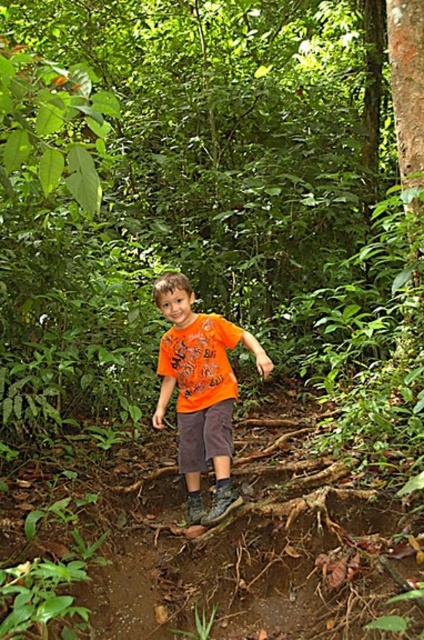
Question: Can you confirm if orange cotton shirt at center is positioned above orange cotton shorts at center?

Choices:
 (A) no
 (B) yes

Answer: (B)

Question: Is orange cotton shirt at center positioned before orange cotton shorts at center?

Choices:
 (A) yes
 (B) no

Answer: (A)

Question: Can you confirm if orange cotton shirt at center is positioned to the left of orange cotton shorts at center?

Choices:
 (A) yes
 (B) no

Answer: (B)

Question: Among these points, which one is nearest to the camera?

Choices:
 (A) (212, 394)
 (B) (206, 435)

Answer: (B)